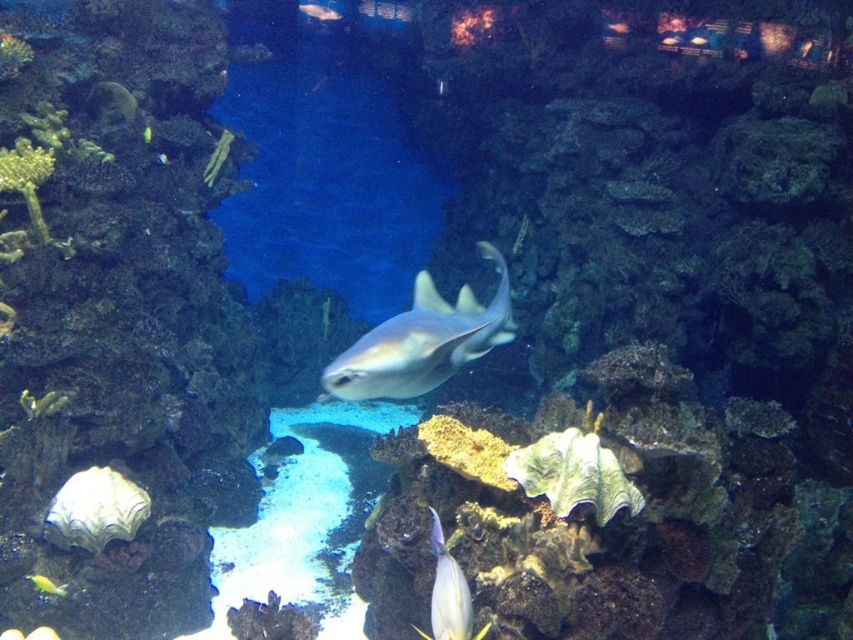
Is matte gray shark at center smaller than shiny silver fish at upper center?

No, matte gray shark at center is not smaller than shiny silver fish at upper center.

Can you confirm if matte gray shark at center is bigger than shiny silver fish at upper center?

Yes.

The image size is (853, 640). Identify the location of matte gray shark at center. (422, 340).

The image size is (853, 640). I want to click on matte gray shark at center, so click(422, 340).

Can you confirm if yellow matte fish at lower left is bigger than shiny green fish at upper left?

Yes.

Where is `yellow matte fish at lower left`? This screenshot has height=640, width=853. yellow matte fish at lower left is located at coordinates (45, 586).

The height and width of the screenshot is (640, 853). I want to click on yellow matte fish at lower left, so click(x=45, y=586).

Which is below, shiny silver fish at lower center or yellow matte fish at lower left?

yellow matte fish at lower left is below.

Is point (445, 552) positioned behind point (47, 592)?

That is False.

This screenshot has height=640, width=853. I want to click on shiny silver fish at lower center, so click(448, 593).